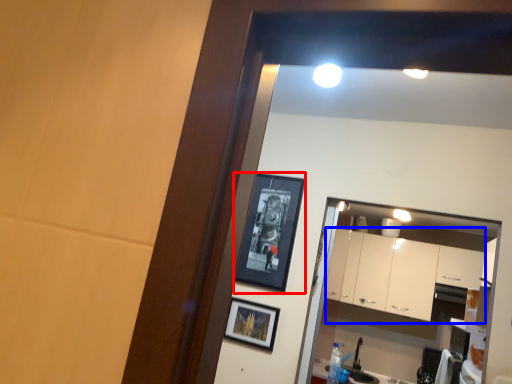
Question: Which object appears farthest to the camera in this image, picture frame (highlighted by a red box) or cabinetry (highlighted by a blue box)?

Choices:
 (A) picture frame
 (B) cabinetry

Answer: (B)